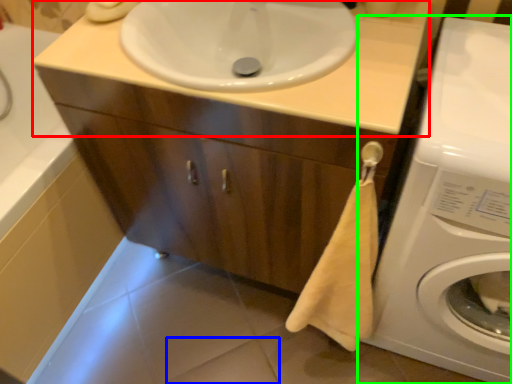
Question: Which object is positioned closest to counter top (highlighted by a red box)? Select from tile (highlighted by a blue box) and washing machine (highlighted by a green box).

Choices:
 (A) tile
 (B) washing machine

Answer: (B)